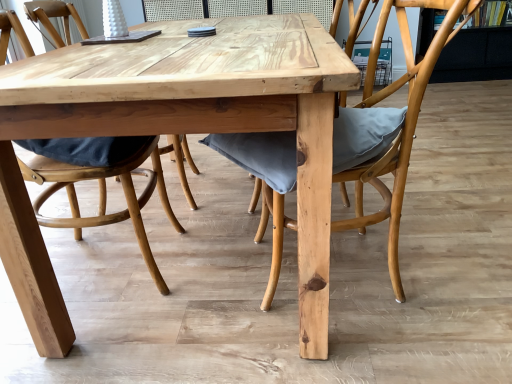
This screenshot has width=512, height=384. What are the coordinates of `vacant space behind matte wood chair at center, acting as the second chair starting from the right` in the screenshot? It's located at (167, 202).